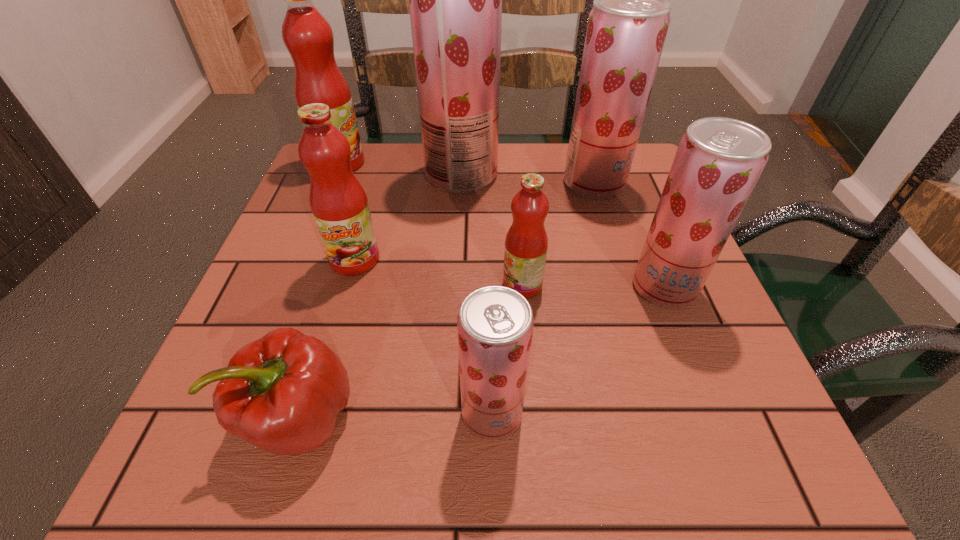
Find the location of a particular element. This screenshot has height=540, width=960. blank space at the far left corner of the desktop is located at coordinates (375, 163).

In order to click on vacant space at the far right corner of the desktop in this screenshot , I will do `click(644, 183)`.

Locate an element on the screen. Image resolution: width=960 pixels, height=540 pixels. vacant space in between the farthest pink fruit juice and the third farthest strawberry fruit juice is located at coordinates (502, 225).

This screenshot has width=960, height=540. Identify the location of vacant area that lies between the farthest pink fruit juice and the smallest strawberry fruit juice. (416, 288).

This screenshot has height=540, width=960. Find the location of `free space between the pepper and the second smallest pink fruit juice`. free space between the pepper and the second smallest pink fruit juice is located at coordinates (327, 339).

Identify the location of vacant area that lies between the second smallest pink fruit juice and the tallest object. (408, 217).

In order to click on free space that is in between the tallest object and the pepper in this screenshot , I will do `click(381, 296)`.

This screenshot has height=540, width=960. Identify the location of blank region between the second biggest strawberry fruit juice and the nearest fruit juice. (543, 298).

In order to click on blank region between the pink pepper and the second smallest pink fruit juice in this screenshot , I will do `click(327, 339)`.

Identify the location of object that is the fourth nearest to the third farthest strawberry fruit juice. (455, 0).